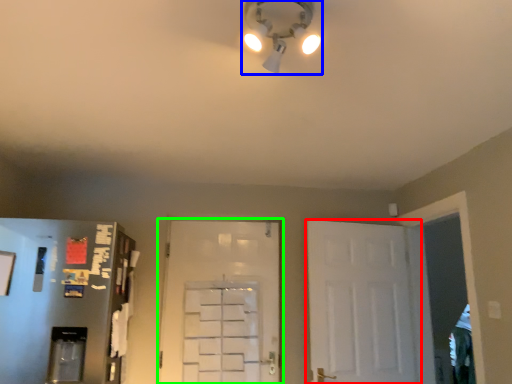
Question: Estimate the real-world distances between objects in this image. Which object is farther from door (highlighted by a red box), light fixture (highlighted by a blue box) or door (highlighted by a green box)?

Choices:
 (A) light fixture
 (B) door

Answer: (A)